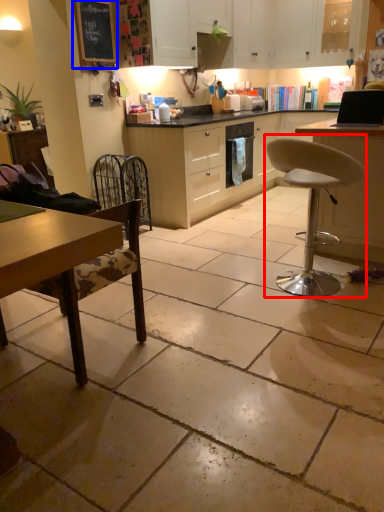
Question: Among these objects, which one is farthest to the camera, chair (highlighted by a red box) or bulletin board (highlighted by a blue box)?

Choices:
 (A) chair
 (B) bulletin board

Answer: (B)